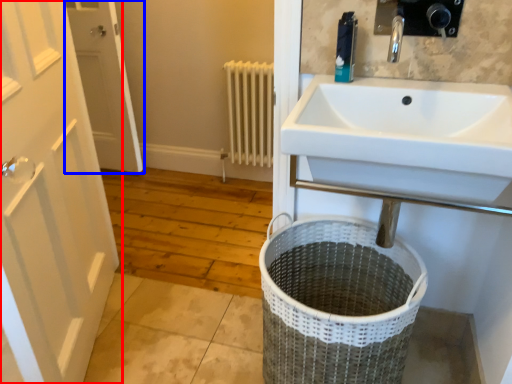
Question: Which point is closer to the camera, door (highlighted by a red box) or door (highlighted by a blue box)?

Choices:
 (A) door
 (B) door

Answer: (A)